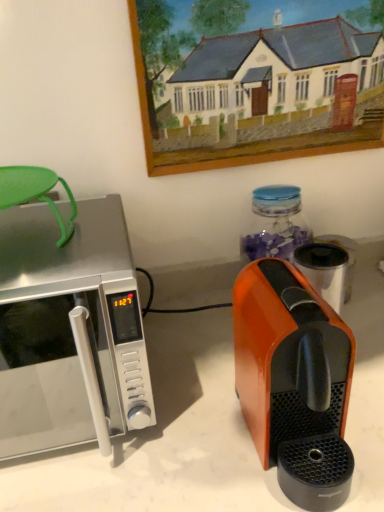
Question: Is orange glossy coffee maker at right to the left or to the right of satin silver microwave at left in the image?

Choices:
 (A) left
 (B) right

Answer: (B)

Question: Which is correct: orange glossy coffee maker at right is inside satin silver microwave at left, or outside of it?

Choices:
 (A) inside
 (B) outside

Answer: (B)

Question: Based on their relative distances, which object is farther from the satin silver microwave at left?

Choices:
 (A) orange glossy coffee maker at right
 (B) wooden picture frame at upper center

Answer: (B)

Question: Which object is positioned closest to the wooden picture frame at upper center?

Choices:
 (A) orange glossy coffee maker at right
 (B) satin silver microwave at left

Answer: (B)